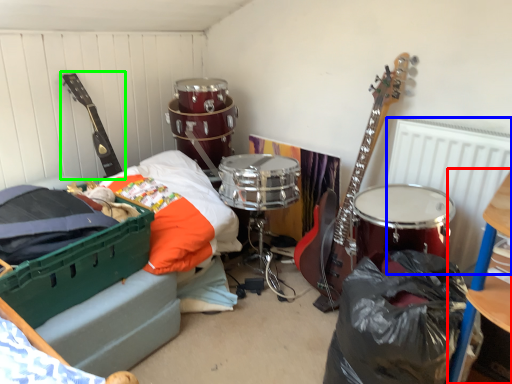
Question: Which object is positioned closest to furniture (highlighted by a red box)? Select from radiator (highlighted by a blue box) and guitar (highlighted by a green box).

Choices:
 (A) radiator
 (B) guitar

Answer: (A)